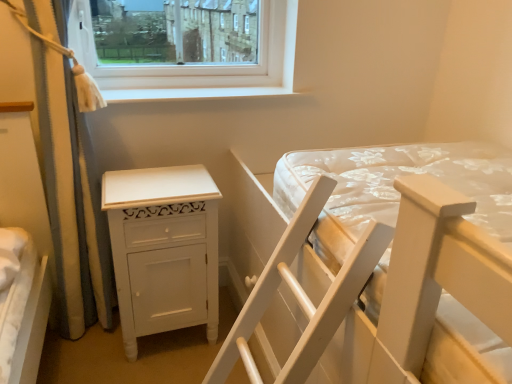
Question: Are white wooden bed at center and white painted wood nightstand at lower left making contact?

Choices:
 (A) no
 (B) yes

Answer: (A)

Question: Would you say white painted wood nightstand at lower left is part of white wooden bed at center's contents?

Choices:
 (A) yes
 (B) no

Answer: (B)

Question: Is white wooden bed at center looking in the opposite direction of white painted wood nightstand at lower left?

Choices:
 (A) no
 (B) yes

Answer: (A)

Question: Can you confirm if white wooden bed at center is shorter than white painted wood nightstand at lower left?

Choices:
 (A) no
 (B) yes

Answer: (A)

Question: Could you tell me if white wooden bed at center is turned towards white painted wood nightstand at lower left?

Choices:
 (A) no
 (B) yes

Answer: (A)

Question: Does white wooden bed at center appear on the right side of white painted wood nightstand at lower left?

Choices:
 (A) no
 (B) yes

Answer: (B)

Question: Is white smooth window sill at upper center not close to white textured curtain at left?

Choices:
 (A) yes
 (B) no

Answer: (B)

Question: Would you say white textured curtain at left is part of white smooth window sill at upper center's contents?

Choices:
 (A) yes
 (B) no

Answer: (B)

Question: Is white smooth window sill at upper center oriented towards white textured curtain at left?

Choices:
 (A) no
 (B) yes

Answer: (A)

Question: Can you confirm if white smooth window sill at upper center is thinner than white textured curtain at left?

Choices:
 (A) no
 (B) yes

Answer: (B)

Question: Is white smooth window sill at upper center positioned behind white textured curtain at left?

Choices:
 (A) no
 (B) yes

Answer: (B)

Question: From a real-world perspective, is white smooth window sill at upper center physically above white textured curtain at left?

Choices:
 (A) no
 (B) yes

Answer: (B)

Question: From a real-world perspective, is white wooden bed at center located beneath white smooth window sill at upper center?

Choices:
 (A) no
 (B) yes

Answer: (B)